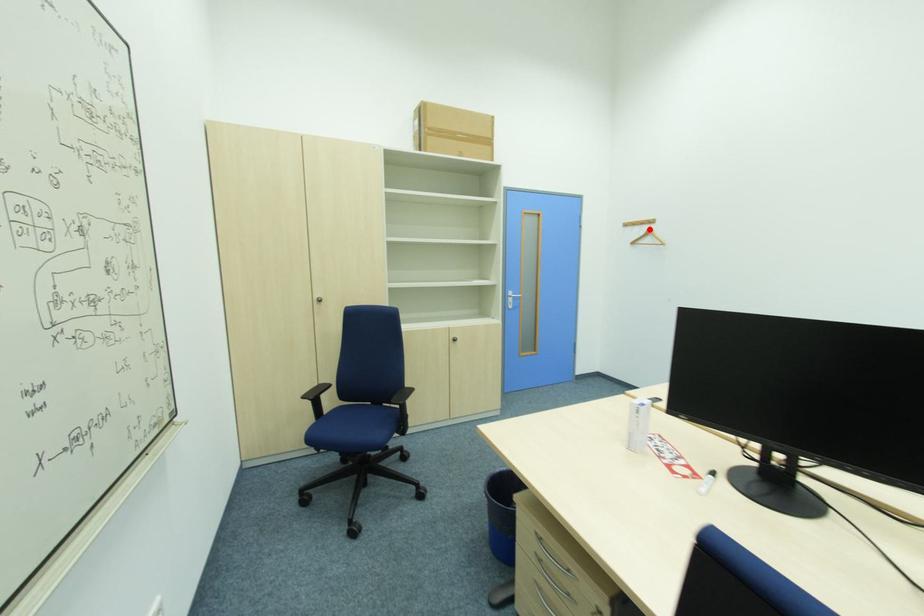
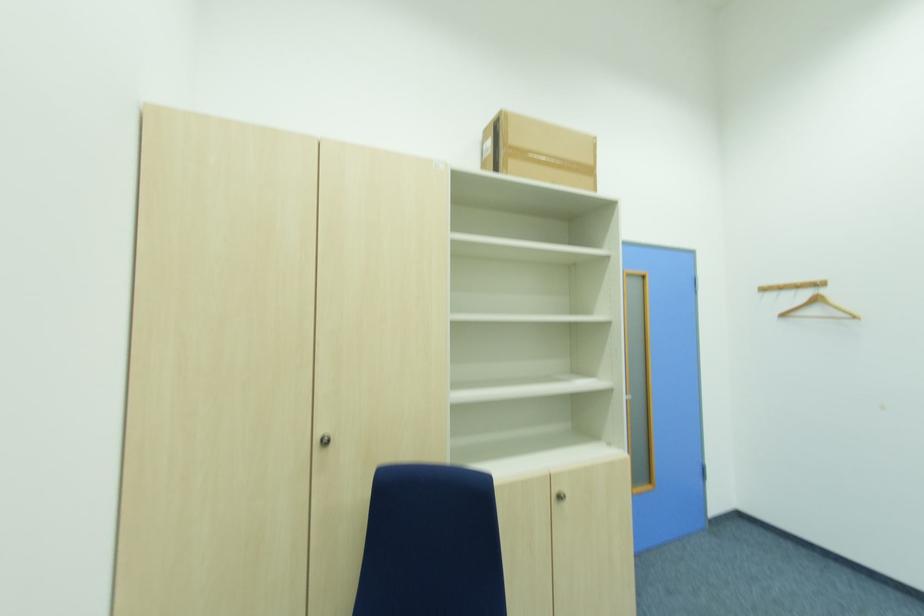
Where in the second image is the point corresponding to the highlighted location from the first image?

(809, 296)